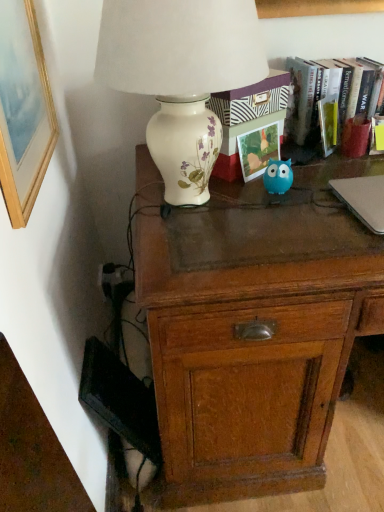
The image size is (384, 512). What are the coordinates of `free area in between porcelain floral lamp at upper left and silver metallic laptop at right` in the screenshot? It's located at (297, 209).